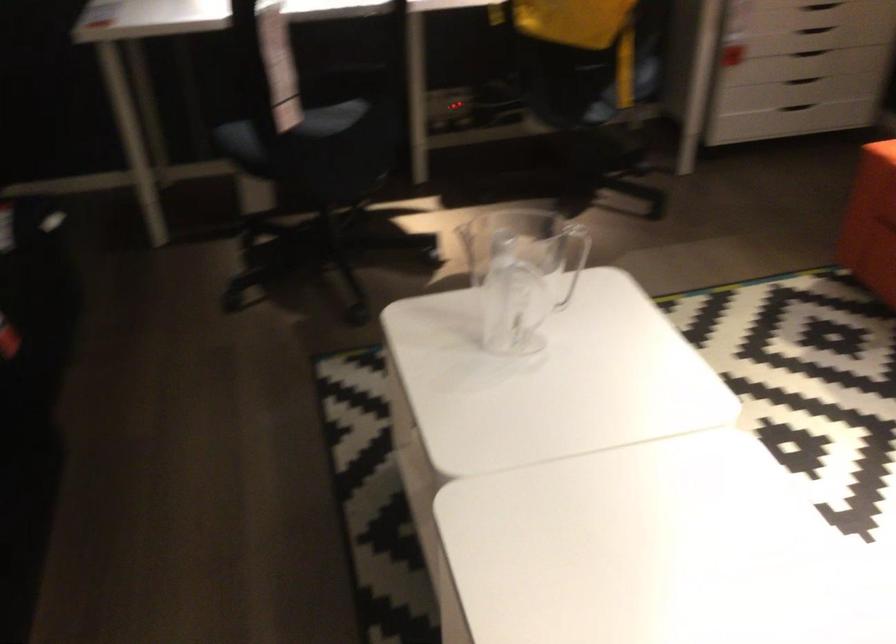
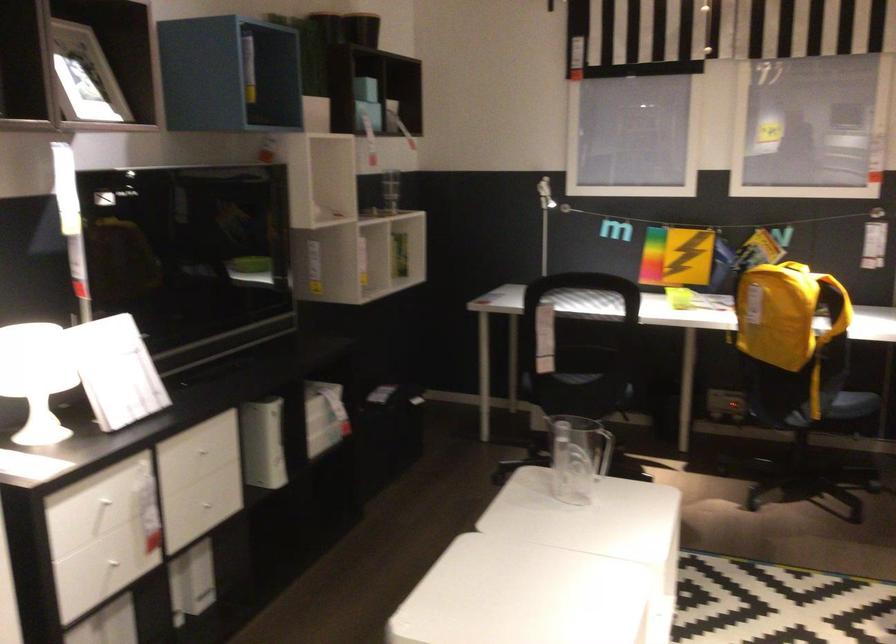
Find the pixel in the second image that matches the point at 315,165 in the first image.

(571, 393)